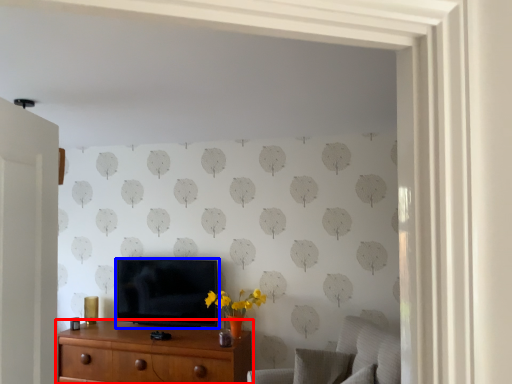
Question: Which point is further to the camera, chest of drawers (highlighted by a red box) or television (highlighted by a blue box)?

Choices:
 (A) chest of drawers
 (B) television

Answer: (B)